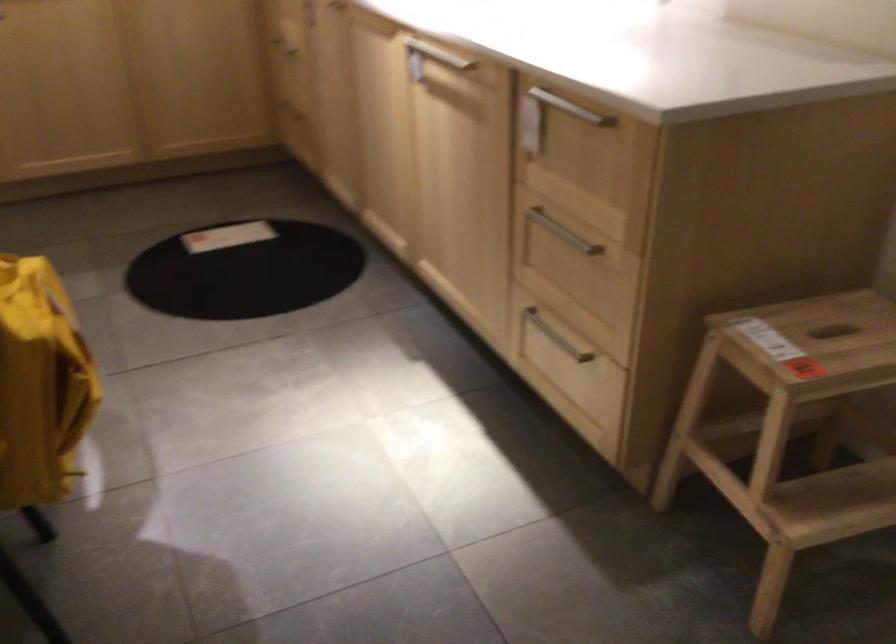
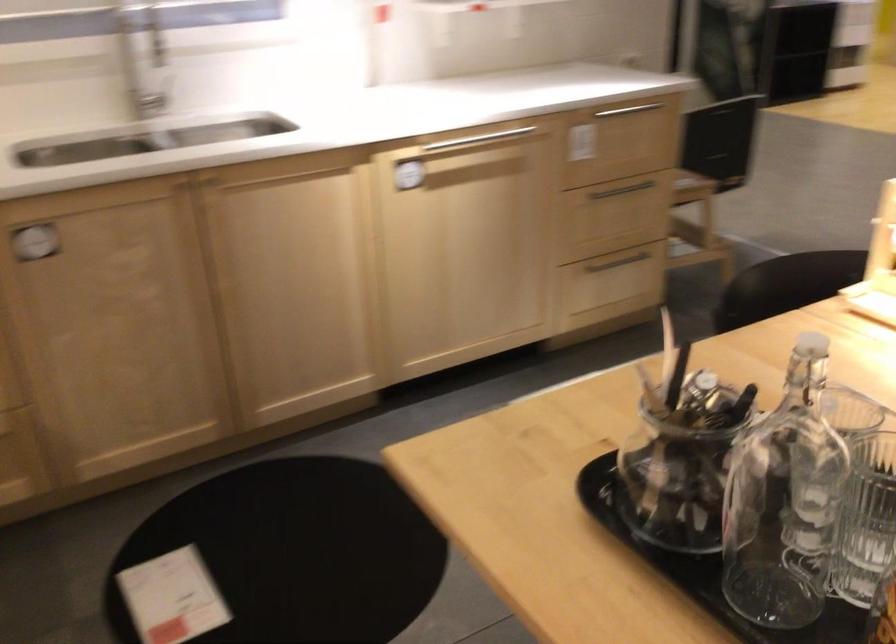
Locate, in the second image, the point that corresponds to the point at 242,263 in the first image.

(295, 553)